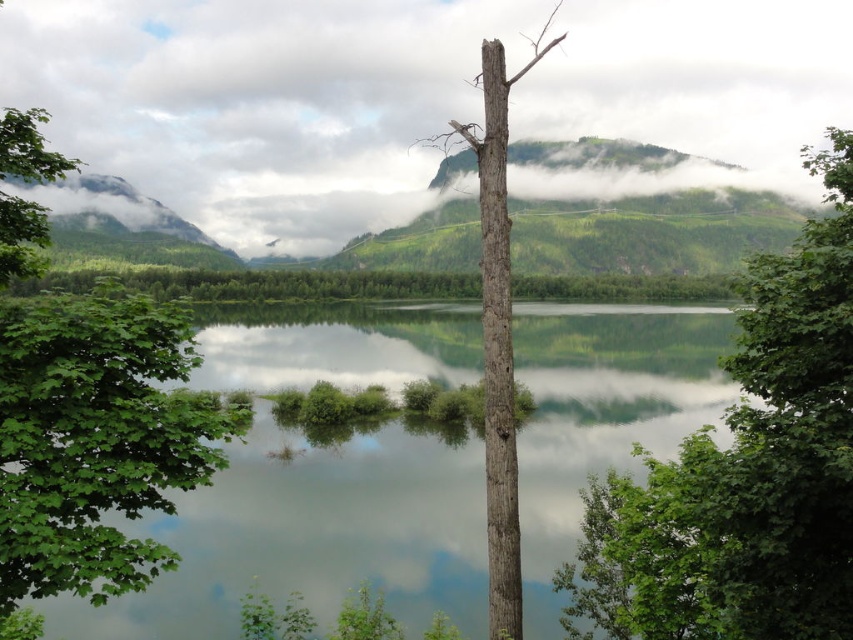
Who is taller, green leafy tree at left or green forested mountain at upper left?

With more height is green forested mountain at upper left.

Between green leafy tree at left and green forested mountain at upper left, which one is positioned lower?

green leafy tree at left

Between point (122, 580) and point (136, 211), which one is positioned behind?

Positioned behind is point (136, 211).

This screenshot has height=640, width=853. Identify the location of green leafy tree at left. (90, 426).

Who is positioned more to the right, green matte tree at upper right or grayish-brown bark tree at center?

Positioned to the right is green matte tree at upper right.

Is point (566, 608) farther from camera compared to point (491, 353)?

Yes, point (566, 608) is farther from viewer.

Locate an element on the screen. This screenshot has width=853, height=640. green matte tree at upper right is located at coordinates (746, 470).

In order to click on green leafy tree at left in this screenshot , I will do `click(90, 426)`.

Can you confirm if green leafy tree at left is positioned above grayish-brown bark tree at center?

Actually, green leafy tree at left is below grayish-brown bark tree at center.

Which is behind, point (142, 380) or point (502, 560)?

Positioned behind is point (502, 560).

Where is `green leafy tree at left`? This screenshot has width=853, height=640. green leafy tree at left is located at coordinates (90, 426).